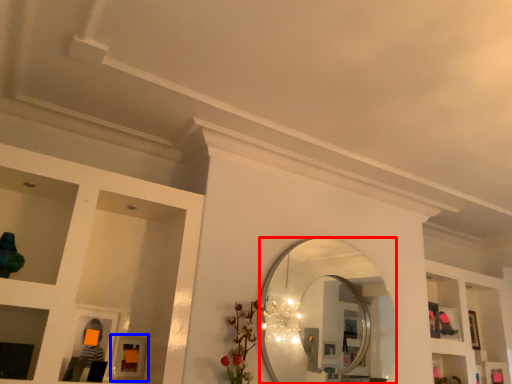
Question: Which of the following is the farthest to the observer, mirror (highlighted by a red box) or picture frame (highlighted by a blue box)?

Choices:
 (A) mirror
 (B) picture frame

Answer: (A)